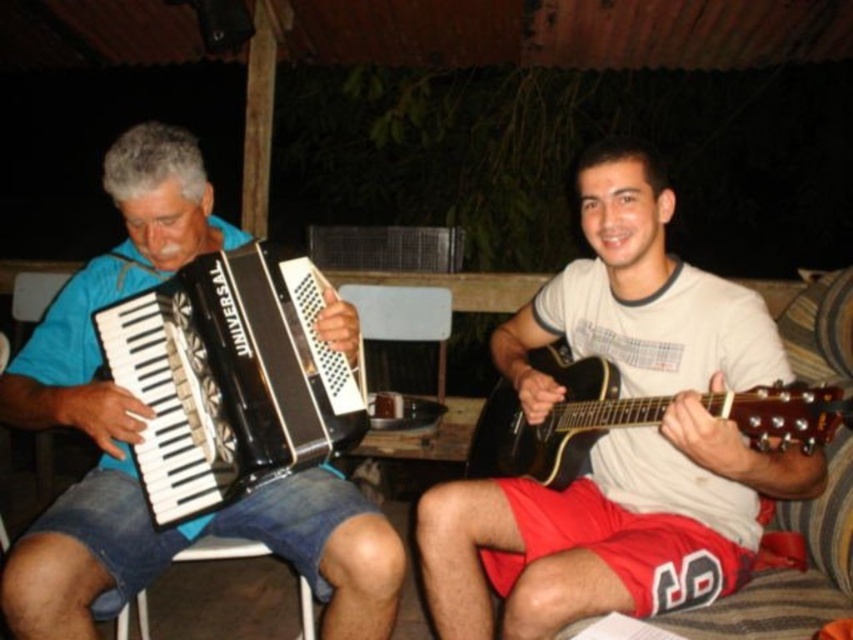
Question: From the image, what is the correct spatial relationship of white matte guitar at right in relation to black matte accordion at left?

Choices:
 (A) right
 (B) left

Answer: (A)

Question: Which of the following is the farthest from the observer?

Choices:
 (A) black matte accordion at left
 (B) black glossy guitar at right
 (C) suede-like fabric couch at right

Answer: (C)

Question: Which point is farther to the camera?

Choices:
 (A) (549, 348)
 (B) (492, 480)

Answer: (A)

Question: Is black matte accordion at left positioned behind black glossy guitar at right?

Choices:
 (A) yes
 (B) no

Answer: (A)

Question: Does black matte accordion at left appear on the left side of suede-like fabric couch at right?

Choices:
 (A) no
 (B) yes

Answer: (B)

Question: Which of the following is the closest to the observer?

Choices:
 (A) black glossy guitar at right
 (B) black plastic accordion at left
 (C) suede-like fabric couch at right
 (D) black matte accordion at left

Answer: (A)